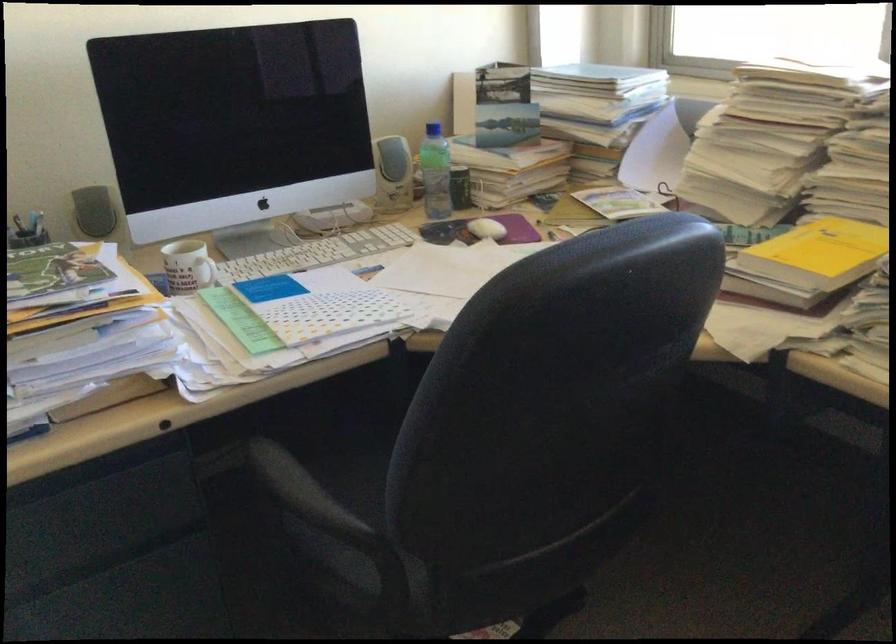
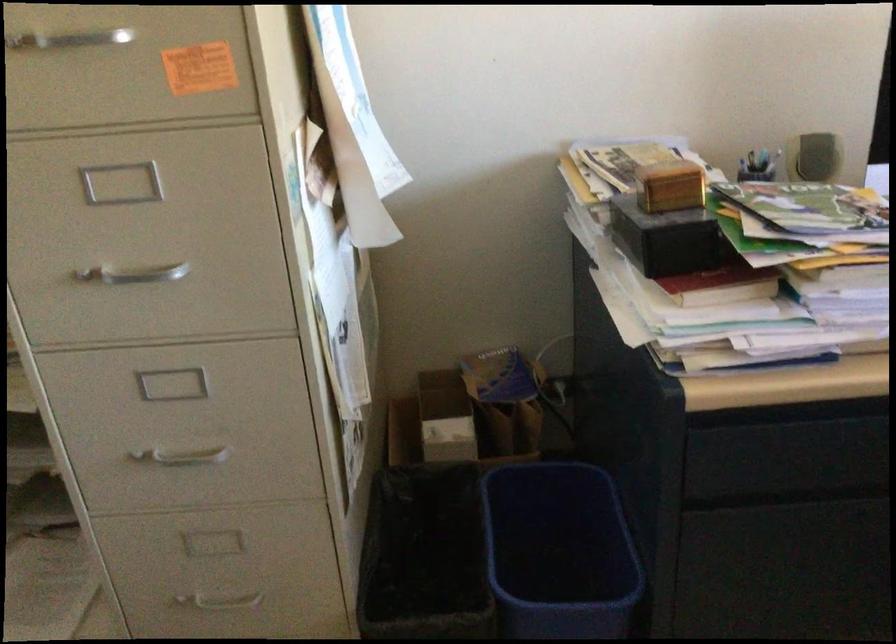
Question: Based on the continuous images, in which direction is the camera rotating? Reply with the corresponding letter.

Choices:
 (A) Left
 (B) Right
 (C) Up
 (D) Down

Answer: (A)